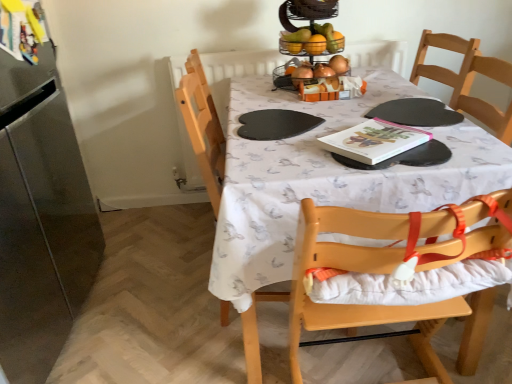
Image resolution: width=512 pixels, height=384 pixels. What do you see at coordinates (313, 40) in the screenshot?
I see `shiny metallic fruit basket at upper center` at bounding box center [313, 40].

What is the approximate width of shiny metallic fruit basket at upper center?

It is 8.83 inches.

Locate an element on the screen. The width and height of the screenshot is (512, 384). hardcover book at center is located at coordinates (374, 141).

I want to click on white printed tablecloth at center, so click(327, 179).

Image resolution: width=512 pixels, height=384 pixels. Find the location of `shiny metallic fruit basket at upper center`. shiny metallic fruit basket at upper center is located at coordinates (313, 40).

This screenshot has height=384, width=512. In order to click on fruit on the left of white printed tablecloth at center in this screenshot , I will do pyautogui.click(x=313, y=40).

Would you consider white printed tablecloth at center to be distant from shiny metallic fruit basket at upper center?

They are positioned close to each other.

From the image's perspective, which one is positioned lower, white printed tablecloth at center or shiny metallic fruit basket at upper center?

white printed tablecloth at center.

Does white printed tablecloth at center appear on the right side of shiny metallic fruit basket at upper center?

Correct, you'll find white printed tablecloth at center to the right of shiny metallic fruit basket at upper center.

Measure the distance from stainless steel refrigerator at left to hardcover book at center.

stainless steel refrigerator at left and hardcover book at center are 3.84 feet apart.

From a real-world perspective, between stainless steel refrigerator at left and hardcover book at center, who is vertically lower?

stainless steel refrigerator at left, from a real-world perspective.

Does stainless steel refrigerator at left come in front of hardcover book at center?

That is True.

Considering the positions of point (48, 135) and point (419, 133), is point (48, 135) closer or farther from the camera than point (419, 133)?

Clearly, point (48, 135) is more distant from the camera than point (419, 133).

Is point (347, 134) positioned in front of point (88, 280)?

That is True.

Considering the sizes of hardcover book at center and stainless steel refrigerator at left in the image, is hardcover book at center bigger or smaller than stainless steel refrigerator at left?

hardcover book at center is smaller than stainless steel refrigerator at left.

From a real-world perspective, is hardcover book at center under stainless steel refrigerator at left?

No, from a real-world perspective, hardcover book at center is not beneath stainless steel refrigerator at left.

From the image's perspective, is light wood highchair at center below stainless steel refrigerator at left?

Yes.

Is light wood highchair at center in contact with stainless steel refrigerator at left?

No, light wood highchair at center is not in contact with stainless steel refrigerator at left.

Where is `chair lying on the right of stainless steel refrigerator at left`? The height and width of the screenshot is (384, 512). chair lying on the right of stainless steel refrigerator at left is located at coordinates (345, 304).

From the image's perspective, who appears lower, shiny metallic fruit basket at upper center or stainless steel refrigerator at left?

stainless steel refrigerator at left.

Consider the image. From a real-world perspective, is shiny metallic fruit basket at upper center physically located above or below stainless steel refrigerator at left?

In terms of real-world spatial position, shiny metallic fruit basket at upper center is above stainless steel refrigerator at left.

Considering the relative sizes of shiny metallic fruit basket at upper center and stainless steel refrigerator at left in the image provided, is shiny metallic fruit basket at upper center taller than stainless steel refrigerator at left?

No, shiny metallic fruit basket at upper center is not taller than stainless steel refrigerator at left.

Is shiny metallic fruit basket at upper center with stainless steel refrigerator at left?

No, shiny metallic fruit basket at upper center is not making contact with stainless steel refrigerator at left.

Would you say white printed tablecloth at center is a long distance from hardcover book at center?

No, there isn't a large distance between white printed tablecloth at center and hardcover book at center.

Which of these two, white printed tablecloth at center or hardcover book at center, is thinner?

hardcover book at center.

From the image's perspective, which is below, white printed tablecloth at center or hardcover book at center?

From the image's view, white printed tablecloth at center is below.

Which is closer to the camera, (x=409, y=173) or (x=417, y=136)?

Point (x=409, y=173) is closer to the camera than point (x=417, y=136).

From the image's perspective, would you say light wood highchair at center is positioned over white printed tablecloth at center?

Actually, light wood highchair at center appears below white printed tablecloth at center in the image.

Which of these two, light wood highchair at center or white printed tablecloth at center, stands taller?

light wood highchair at center is taller.

Between light wood highchair at center and white printed tablecloth at center, which one appears on the right side from the viewer's perspective?

Positioned to the right is light wood highchair at center.

You are a GUI agent. You are given a task and a screenshot of the screen. Output one action in this format:
    pyautogui.click(x=<x>, y=<y>)
    Task: Click on the chair below the white printed tablecloth at center (from the image's perspective)
    This screenshot has height=384, width=512.
    Given the screenshot: What is the action you would take?
    pyautogui.click(x=345, y=304)

Where is `fruit that appears above the white printed tablecloth at center (from the image's perspective)`? fruit that appears above the white printed tablecloth at center (from the image's perspective) is located at coordinates [x=313, y=40].

Locate an element on the screen. appliance on the left of hardcover book at center is located at coordinates (40, 206).

Estimate the real-world distances between objects in this image. Which object is closer to hardcover book at center, white printed tablecloth at center or light wood highchair at center?

white printed tablecloth at center is closer to hardcover book at center.

Considering their positions, is hardcover book at center positioned closer to stainless steel refrigerator at left than white printed tablecloth at center?

white printed tablecloth at center is positioned closer to the anchor stainless steel refrigerator at left.

Estimate the real-world distances between objects in this image. Which object is further from hardcover book at center, light wood highchair at center or stainless steel refrigerator at left?

stainless steel refrigerator at left lies further to hardcover book at center than the other object.

Looking at this image, estimate the real-world distances between objects in this image. Which object is further from hardcover book at center, shiny metallic fruit basket at upper center or stainless steel refrigerator at left?

stainless steel refrigerator at left is positioned further to the anchor hardcover book at center.

When comparing their distances from hardcover book at center, does shiny metallic fruit basket at upper center or white printed tablecloth at center seem closer?

white printed tablecloth at center lies closer to hardcover book at center than the other object.

From the image, which object appears to be nearer to light wood highchair at center, white printed tablecloth at center or shiny metallic fruit basket at upper center?

white printed tablecloth at center.

Looking at the image, which one is located closer to shiny metallic fruit basket at upper center, stainless steel refrigerator at left or white printed tablecloth at center?

white printed tablecloth at center.

From the image, which object appears to be farther from white printed tablecloth at center, light wood highchair at center or stainless steel refrigerator at left?

Based on the image, stainless steel refrigerator at left appears to be further to white printed tablecloth at center.

Find the location of a particular element. The height and width of the screenshot is (384, 512). tablecloth located between stainless steel refrigerator at left and hardcover book at center in the left-right direction is located at coordinates (327, 179).

Find the location of a particular element. The image size is (512, 384). book between stainless steel refrigerator at left and light wood highchair at center is located at coordinates (374, 141).

Find the location of a particular element. The image size is (512, 384). fruit between stainless steel refrigerator at left and white printed tablecloth at center is located at coordinates point(313,40).

Identify the location of book positioned between white printed tablecloth at center and shiny metallic fruit basket at upper center from near to far. Image resolution: width=512 pixels, height=384 pixels. (374, 141).